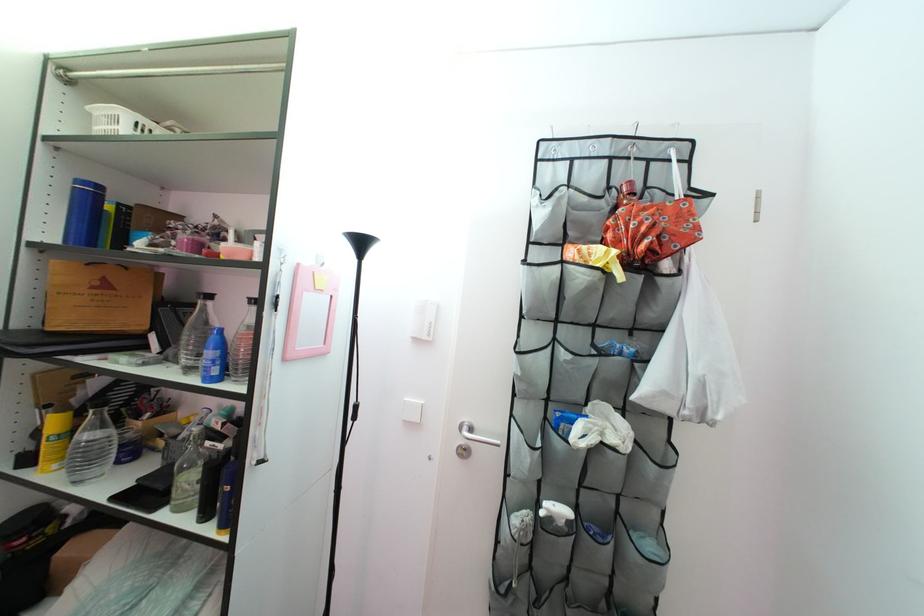
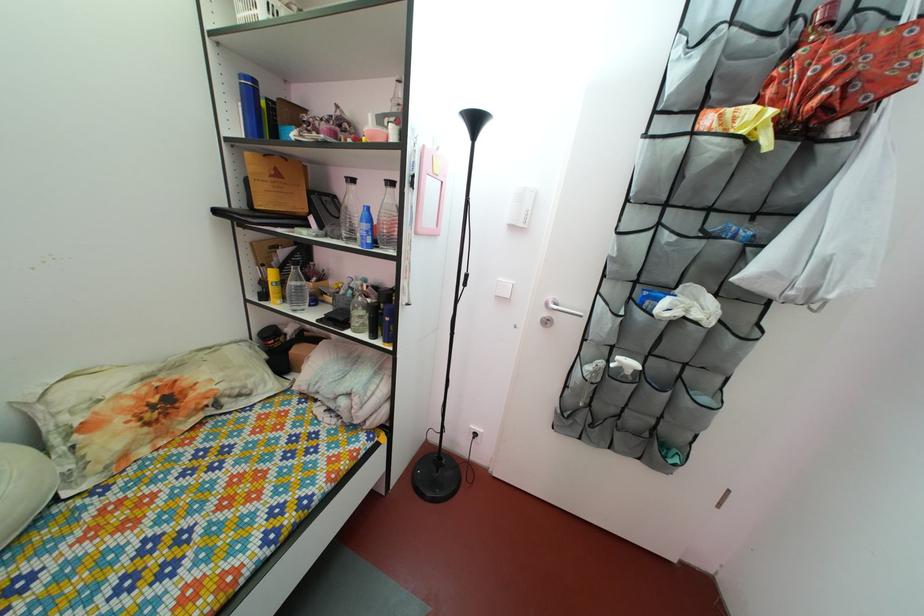
The point at (106, 391) is marked in the first image. Where is the corresponding point in the second image?

(292, 262)